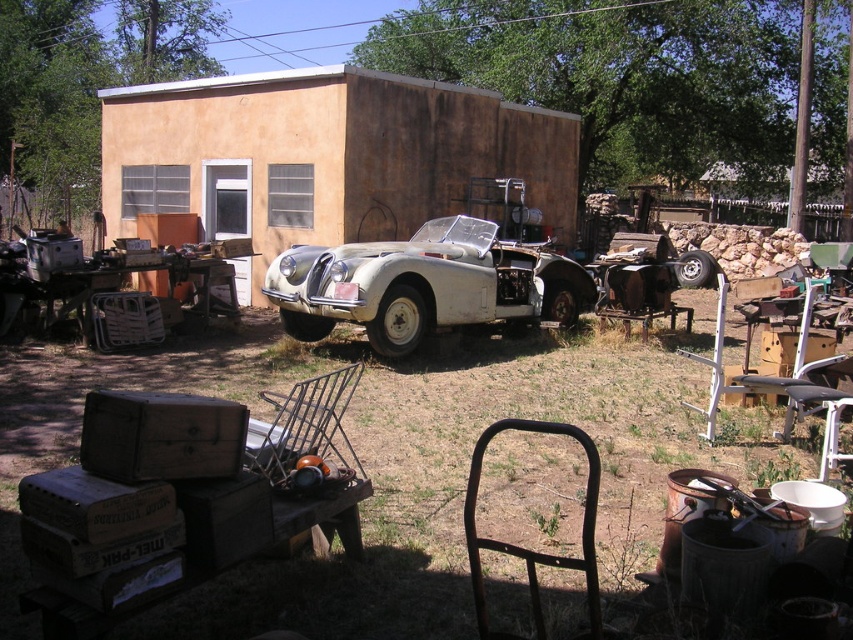
You are a delivery person trying to reach the door of the building behind the vintage car. You see the white matte car at center and the rusty metal chair at lower center. Which object is blocking your path to the door?

The rusty metal chair at lower center is behind the white matte car at center, so the white matte car at center is blocking your path to the door.

You are standing in front of the vintage car and looking at the scene. Where is the matte orange wall at center located in terms of coordinates?

The matte orange wall at center is located at coordinates point (323,157).